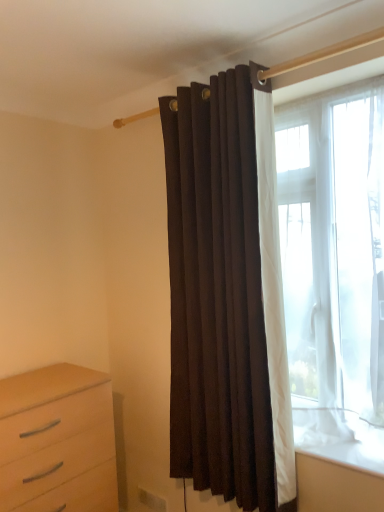
Question: Should I look upward or downward to see transparent fabric window at right?

Choices:
 (A) down
 (B) up

Answer: (A)

Question: Is transparent fabric window at right behind light wood chest of drawers at lower left?

Choices:
 (A) no
 (B) yes

Answer: (A)

Question: Considering the relative sizes of transparent fabric window at right and light wood chest of drawers at lower left in the image provided, is transparent fabric window at right taller than light wood chest of drawers at lower left?

Choices:
 (A) no
 (B) yes

Answer: (B)

Question: Is transparent fabric window at right facing towards light wood chest of drawers at lower left?

Choices:
 (A) yes
 (B) no

Answer: (B)

Question: Considering the relative positions of transparent fabric window at right and light wood chest of drawers at lower left in the image provided, is transparent fabric window at right to the right of light wood chest of drawers at lower left from the viewer's perspective?

Choices:
 (A) yes
 (B) no

Answer: (A)

Question: Can you confirm if transparent fabric window at right is smaller than light wood chest of drawers at lower left?

Choices:
 (A) yes
 (B) no

Answer: (A)

Question: Considering the relative sizes of transparent fabric window at right and light wood chest of drawers at lower left in the image provided, is transparent fabric window at right thinner than light wood chest of drawers at lower left?

Choices:
 (A) no
 (B) yes

Answer: (B)

Question: Does light wood chest of drawers at lower left have a larger size compared to suede-like brown curtain at center?

Choices:
 (A) no
 (B) yes

Answer: (B)

Question: Is light wood chest of drawers at lower left wider than suede-like brown curtain at center?

Choices:
 (A) yes
 (B) no

Answer: (A)

Question: Is light wood chest of drawers at lower left not within suede-like brown curtain at center?

Choices:
 (A) no
 (B) yes

Answer: (B)

Question: Is light wood chest of drawers at lower left touching suede-like brown curtain at center?

Choices:
 (A) no
 (B) yes

Answer: (A)

Question: Is light wood chest of drawers at lower left oriented towards suede-like brown curtain at center?

Choices:
 (A) yes
 (B) no

Answer: (B)

Question: Is light wood chest of drawers at lower left looking in the opposite direction of suede-like brown curtain at center?

Choices:
 (A) yes
 (B) no

Answer: (B)

Question: Is suede-like brown curtain at center at the back of transparent fabric window at right?

Choices:
 (A) no
 (B) yes

Answer: (A)